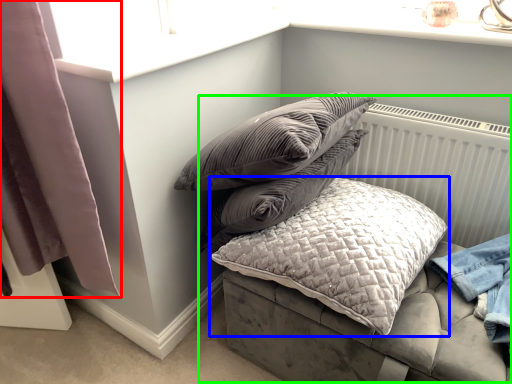
Question: Based on their relative distances, which object is farther from curtain (highlighted by a red box)? Choose from pillow (highlighted by a blue box) and bed (highlighted by a green box).

Choices:
 (A) pillow
 (B) bed

Answer: (B)